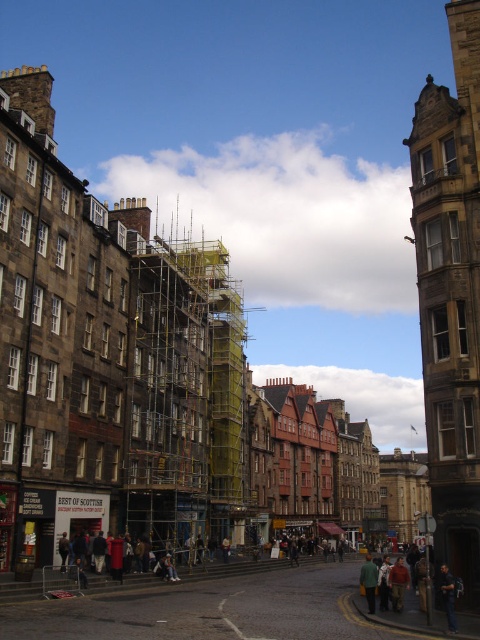
Is the position of yellow-green fabric scaffolding at center less distant than that of yellow fabric jacket at lower center?

No.

Who is taller, yellow-green fabric scaffolding at center or yellow fabric jacket at lower center?

With more height is yellow-green fabric scaffolding at center.

Which is in front, point (147, 445) or point (360, 573)?

Point (147, 445) is more forward.

Image resolution: width=480 pixels, height=640 pixels. In order to click on yellow-green fabric scaffolding at center in this screenshot , I will do `click(183, 394)`.

Between point (216, 465) and point (35, 634), which one is positioned in front?

Point (35, 634) is more forward.

Which of these two, yellow-green fabric scaffolding at center or scaffolding at center, stands taller?

yellow-green fabric scaffolding at center

Where is `yellow-green fabric scaffolding at center`? This screenshot has width=480, height=640. yellow-green fabric scaffolding at center is located at coordinates (183, 394).

Based on the photo, which is above, scaffolding at center or yellow fabric jacket at lower center?

scaffolding at center is above.

Does scaffolding at center have a greater width compared to yellow fabric jacket at lower center?

Yes, scaffolding at center is wider than yellow fabric jacket at lower center.

Image resolution: width=480 pixels, height=640 pixels. I want to click on scaffolding at center, so click(212, 611).